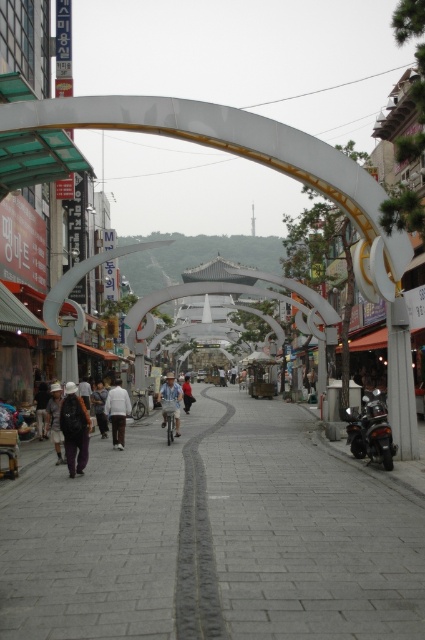
You are a photographer standing on the street and want to capture the cyclist wearing the white matte shirt at center and dark gray pants at center. Which part of the cyclist should you focus on first to ensure the entire outfit is in frame?

The white matte shirt at center is located below dark gray pants at center, so focusing on the dark gray pants at center first will ensure the entire outfit is captured in the frame.

You are a pedestrian standing on the gray concrete pavement at center. You want to reach the shiny black motorcycle at lower right. Which direction should you move to get there?

The gray concrete pavement at center is located below the shiny black motorcycle at lower right, so you should move downward to reach the shiny black motorcycle at lower right.